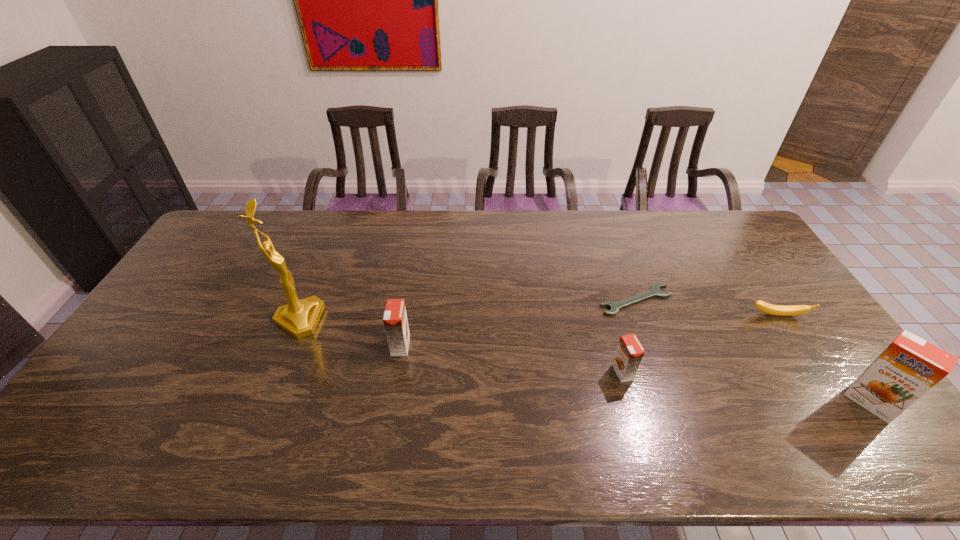
Locate an element on the screen. free space located on the back of the leftmost orange juice is located at coordinates (416, 253).

The image size is (960, 540). Identify the location of free space located 0.090m on the right of the second orange juice from right to left. (665, 372).

Locate an element on the screen. This screenshot has width=960, height=540. free region located on the left of the fifth shortest object is located at coordinates (825, 402).

The height and width of the screenshot is (540, 960). Identify the location of free space located 0.250m on the left of the wrench. (518, 300).

Identify the location of blank space located on the front-facing side of the leftmost object. This screenshot has width=960, height=540. (389, 320).

The width and height of the screenshot is (960, 540). Identify the location of vacant space situated at the stem of the banana. (789, 334).

In order to click on object that is at the near edge in this screenshot , I will do `click(910, 366)`.

The width and height of the screenshot is (960, 540). I want to click on orange juice present at the right edge, so click(x=910, y=366).

The height and width of the screenshot is (540, 960). Identify the location of banana that is at the right edge. (778, 310).

Identify the location of object that is positioned at the near right corner. This screenshot has height=540, width=960. (910, 366).